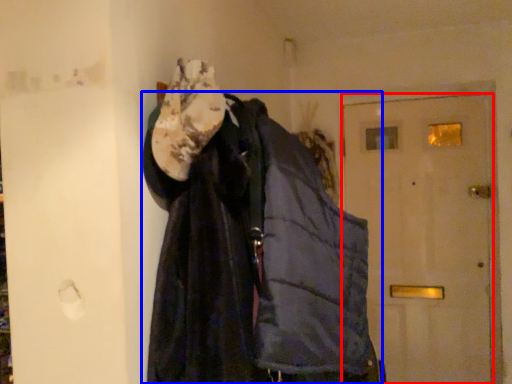
Question: Which of the following is the farthest to the observer, door (highlighted by a red box) or jacket (highlighted by a blue box)?

Choices:
 (A) door
 (B) jacket

Answer: (A)